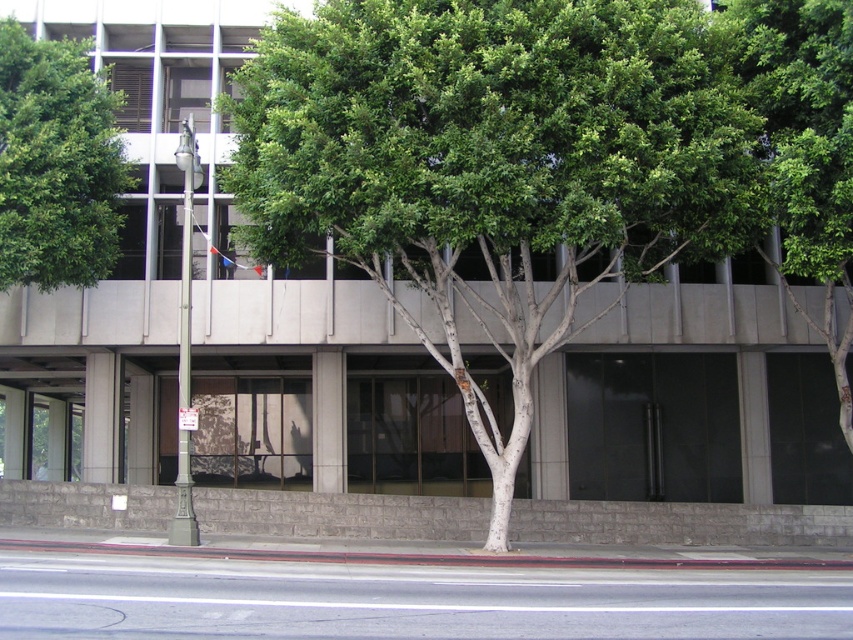
You are standing in front of the modern building and notice two green leafy trees. Which tree, the green leafy tree at upper center or the green leafy tree at upper left, is positioned more to the right side of the building?

The green leafy tree at upper center is positioned more to the right side of the building compared to the green leafy tree at upper left.

You are a city planner reviewing this street scene. You need to determine which tree, the green leafy tree at upper center or the green leafy tree at upper left, requires more space for its canopy. Based on the image, which tree would you prioritize for pruning to maintain clearance around the building?

The green leafy tree at upper left requires more space for its canopy since it occupies more space than the green leafy tree at upper center. Therefore, it should be prioritized for pruning to maintain clearance around the building.

You are a pedestrian standing on the sidewalk in front of the modern building. You notice two green leafy trees. Which tree, the green leafy tree at center or the green leafy tree at upper left, is positioned more to the left?

The green leafy tree at upper left is positioned more to the left because the green leafy tree at center is to the right of it.